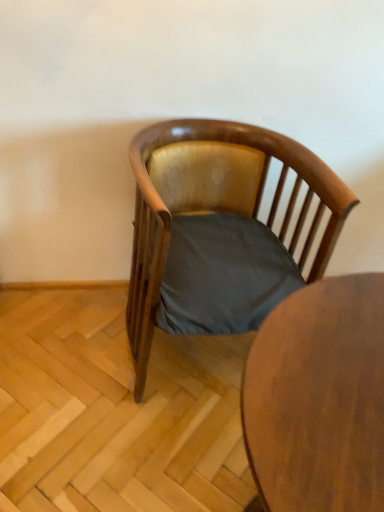
Question: Looking at the image, does wooden polished chair at center seem bigger or smaller compared to wooden table at center?

Choices:
 (A) small
 (B) big

Answer: (B)

Question: From a real-world perspective, is wooden polished chair at center above or below wooden table at center?

Choices:
 (A) below
 (B) above

Answer: (B)

Question: Looking at their shapes, would you say wooden polished chair at center is wider or thinner than wooden table at center?

Choices:
 (A) wide
 (B) thin

Answer: (A)

Question: Does point (339, 372) appear closer or farther from the camera than point (302, 145)?

Choices:
 (A) closer
 (B) farther

Answer: (A)

Question: From the image's perspective, is wooden table at center positioned above or below wooden polished chair at center?

Choices:
 (A) above
 (B) below

Answer: (B)

Question: In terms of width, does wooden table at center look wider or thinner when compared to wooden polished chair at center?

Choices:
 (A) wide
 (B) thin

Answer: (B)

Question: Is wooden table at center situated inside wooden polished chair at center or outside?

Choices:
 (A) outside
 (B) inside

Answer: (A)